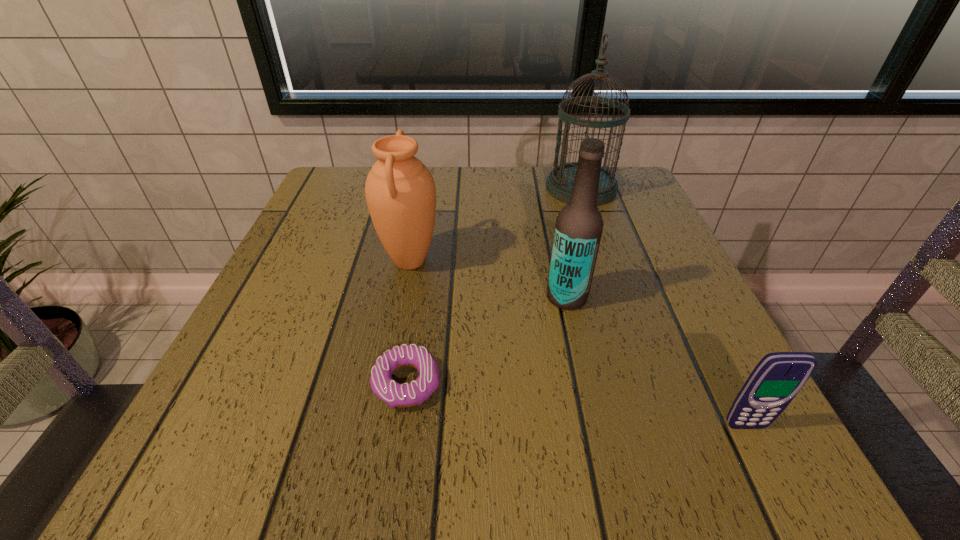
At what (x,y) coordinates should I click in order to perform the action: click on vacant area at the near right corner. Please return your answer as a coordinate pair (x, y). The width and height of the screenshot is (960, 540). Looking at the image, I should click on coord(776,432).

What are the coordinates of `free space that is in between the urn and the cellular telephone` in the screenshot? It's located at (578, 343).

The image size is (960, 540). In order to click on free spot between the beer bottle and the urn in this screenshot , I will do `click(489, 279)`.

The width and height of the screenshot is (960, 540). What are the coordinates of `free area in between the farthest object and the shortest object` in the screenshot? It's located at (494, 286).

Identify the location of empty location between the second shortest object and the shortest object. The height and width of the screenshot is (540, 960). (576, 404).

You are a GUI agent. You are given a task and a screenshot of the screen. Output one action in this format:
    pyautogui.click(x=<x>, y=<y>)
    Task: Click on the vacant area between the shortest object and the second tallest object
    This screenshot has width=960, height=540.
    Given the screenshot: What is the action you would take?
    pyautogui.click(x=487, y=340)

Locate an element on the screen. The image size is (960, 540). empty space that is in between the nearest object and the second nearest object is located at coordinates (576, 404).

This screenshot has height=540, width=960. I want to click on vacant space that's between the shortest object and the nearest object, so click(x=576, y=404).

Image resolution: width=960 pixels, height=540 pixels. In order to click on vacant area between the nearest object and the fourth shortest object in this screenshot , I will do `click(657, 361)`.

You are a GUI agent. You are given a task and a screenshot of the screen. Output one action in this format:
    pyautogui.click(x=<x>, y=<y>)
    Task: Click on the free point between the fourth farthest object and the birdcage
    The image size is (960, 540).
    Given the screenshot: What is the action you would take?
    pyautogui.click(x=494, y=286)